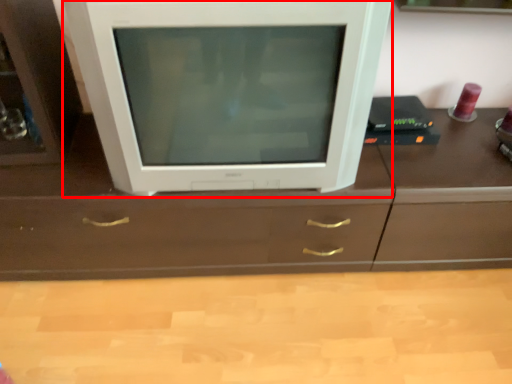
Question: From the image's perspective, where is television (annotated by the red box) located relative to counter top?

Choices:
 (A) below
 (B) above

Answer: (B)